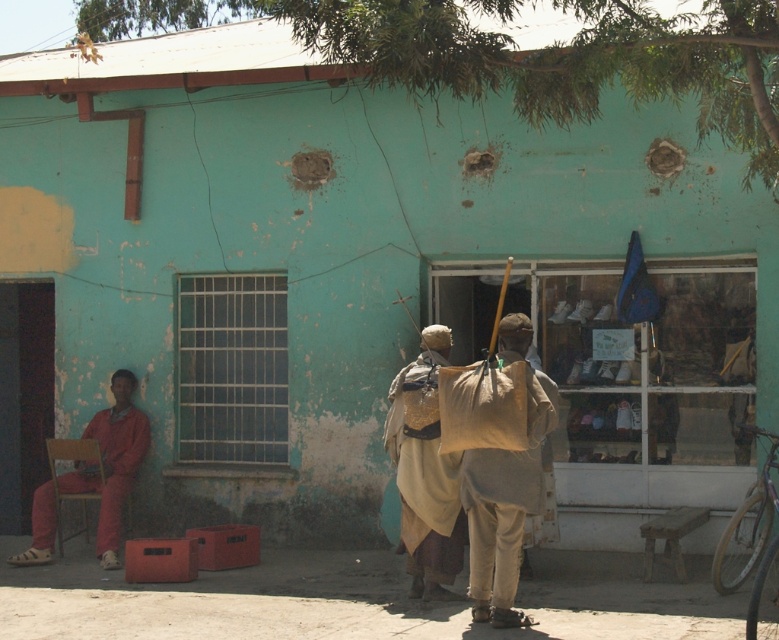
Looking at this image, you are a photographer trying to capture the beige fabric bag at center and the matte orange jumpsuit at left. Which object should you focus on first if you want to ensure both are in sharp focus?

The beige fabric bag at center is closer to the viewer than the matte orange jumpsuit at left. To ensure both are in sharp focus, you should focus on the matte orange jumpsuit at left first since it is farther away, allowing the depth of field to cover the closer beige fabric bag at center.

You are a delivery person standing in front of the building with a beige sack at center. You need to place it exactly 30 feet away from where you are standing. Can you place it there without moving?

The beige sack at center is currently 31.41 feet away from the viewer. Since you need to place it exactly 30 feet away without moving, it is slightly too far. You would need to move the sack 1.41 feet closer to meet the requirement.